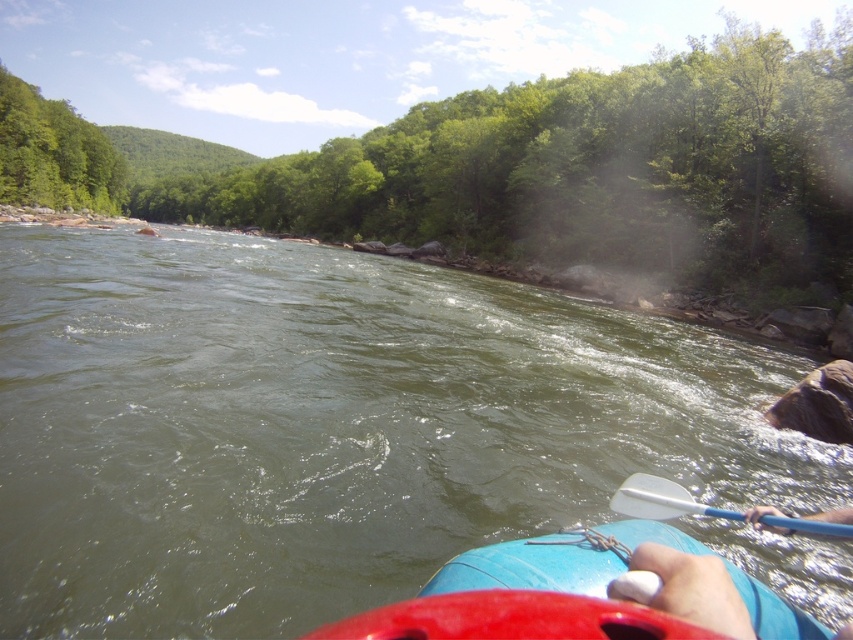
You are a photographer trying to capture the green leafy tree at upper center in your shot. The camera has a rectangular viewfinder with coordinates from 0 to 1 on both axes. Where should you position the center of your viewfinder to frame the tree precisely?

The green leafy tree at upper center is located at the 2D coordinate point of (x=596, y=168), so you should position the center of your viewfinder at those coordinates to frame it precisely.

You are planning to take a photo of both the green leafy tree at upper center and the blue rubber canoe at lower center from a distance. Given their separation, is it possible to capture both in a single frame without moving the camera?

The green leafy tree at upper center and blue rubber canoe at lower center are 483.08 feet apart. At this distance, it would be challenging to capture both in a single frame without moving the camera, as most standard camera lenses have a limited field of view that cannot encompass such a large separation.

You are a photographer trying to capture a closeup of the white plastic paddle at lower center without the green leafy tree at upper left blocking the view. Can you adjust your camera angle to achieve this?

The green leafy tree at upper left is taller than the white plastic paddle at lower center, so tilting the camera downward might help avoid the tree blocking the paddle.